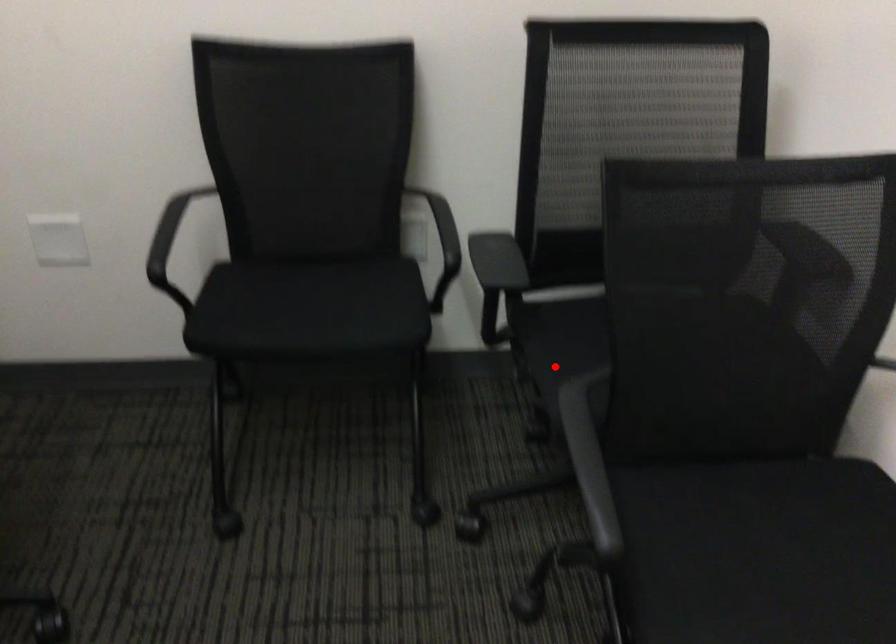
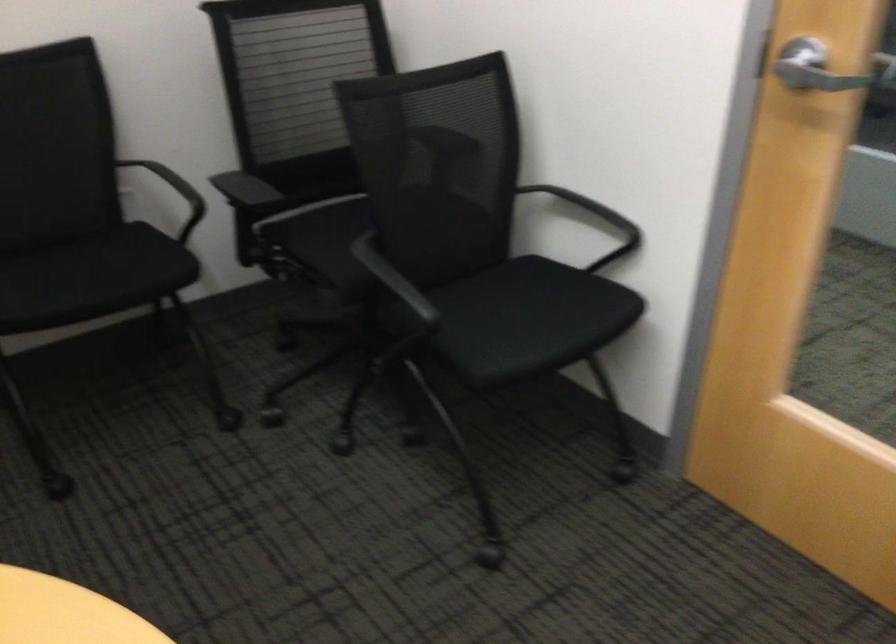
Question: A red point is marked in image1. In image2, is the corresponding 3D point closer to the camera or farther? Reply with the corresponding letter.

Choices:
 (A) The corresponding 3D point is closer.
 (B) The corresponding 3D point is farther.

Answer: (B)